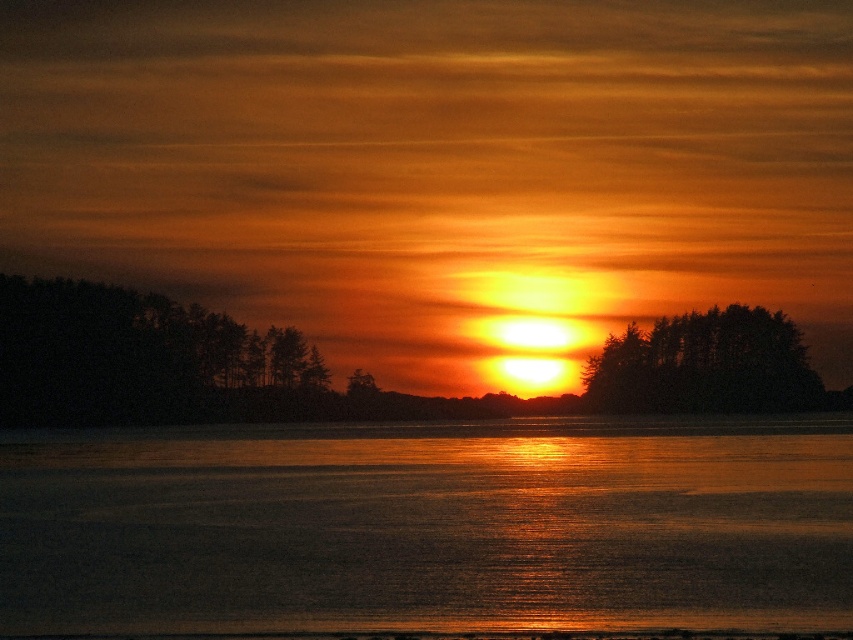
Question: Which point appears farthest from the camera in this image?

Choices:
 (A) (808, 484)
 (B) (657, 378)

Answer: (B)

Question: Is glistening water at center below dark green textured trees at left?

Choices:
 (A) yes
 (B) no

Answer: (A)

Question: Which of these objects is positioned farthest from the dark green textured trees at center?

Choices:
 (A) glistening water at center
 (B) dark green textured trees at left

Answer: (A)

Question: Is glistening water at center bigger than dark green textured trees at left?

Choices:
 (A) no
 (B) yes

Answer: (B)

Question: Which point is closer to the camera?

Choices:
 (A) dark green textured trees at left
 (B) glistening water at center

Answer: (B)

Question: Can you confirm if glistening water at center is smaller than dark green textured trees at center?

Choices:
 (A) no
 (B) yes

Answer: (A)